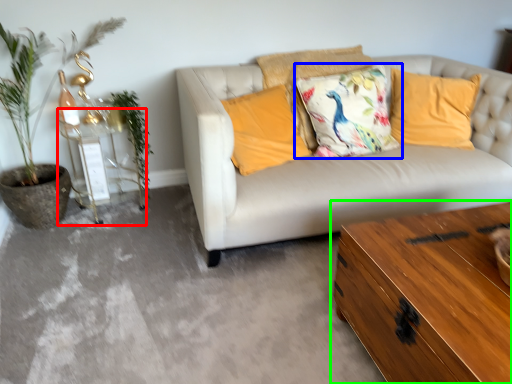
Question: Based on their relative distances, which object is farther from side table (highlighted by a red box)? Choose from pillow (highlighted by a blue box) and table (highlighted by a green box).

Choices:
 (A) pillow
 (B) table

Answer: (B)